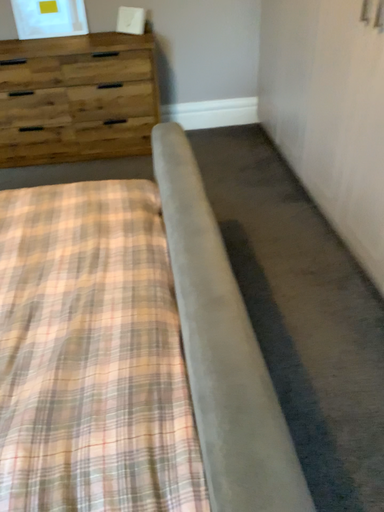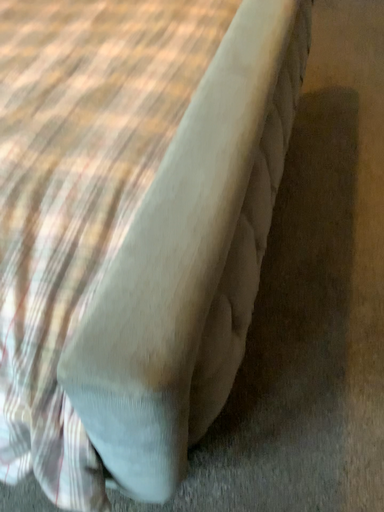
Question: Which way did the camera rotate in the video?

Choices:
 (A) rotated left
 (B) rotated right

Answer: (A)